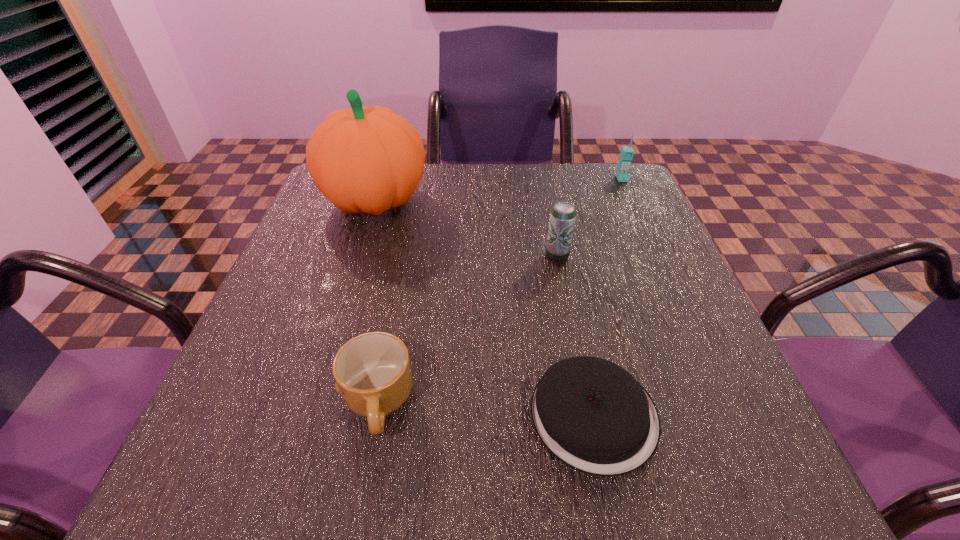
This screenshot has width=960, height=540. Find the location of `vacant space that's between the shortest object and the rightmost object`. vacant space that's between the shortest object and the rightmost object is located at coordinates (608, 297).

Where is `free area in between the rightmost object and the pumpkin`? The height and width of the screenshot is (540, 960). free area in between the rightmost object and the pumpkin is located at coordinates (498, 190).

Locate an element on the screen. The height and width of the screenshot is (540, 960). free space between the pumpkin and the rightmost object is located at coordinates (498, 190).

Image resolution: width=960 pixels, height=540 pixels. What are the coordinates of `free space between the second shortest object and the shortest object` in the screenshot? It's located at (486, 409).

Identify which object is the second closest to the shortest object. Please provide its 2D coordinates. Your answer should be formatted as a tuple, i.e. [(x, y)], where the tuple contains the x and y coordinates of a point satisfying the conditions above.

[(563, 214)]

Locate an element on the screen. object that is the second nearest to the pancake is located at coordinates pyautogui.click(x=563, y=214).

This screenshot has width=960, height=540. In order to click on free location that satisfies the following two spatial constraints: 1. on the side with the handle of the pancake; 2. on the right side of the fourth tallest object in this screenshot , I will do `click(375, 415)`.

Locate an element on the screen. The height and width of the screenshot is (540, 960). vacant area that satisfies the following two spatial constraints: 1. on the side with the handle of the mug; 2. on the left side of the pancake is located at coordinates (375, 415).

Where is `free space that satisfies the following two spatial constraints: 1. on the front side of the pumpkin; 2. on the left side of the third farthest object`? free space that satisfies the following two spatial constraints: 1. on the front side of the pumpkin; 2. on the left side of the third farthest object is located at coordinates (357, 256).